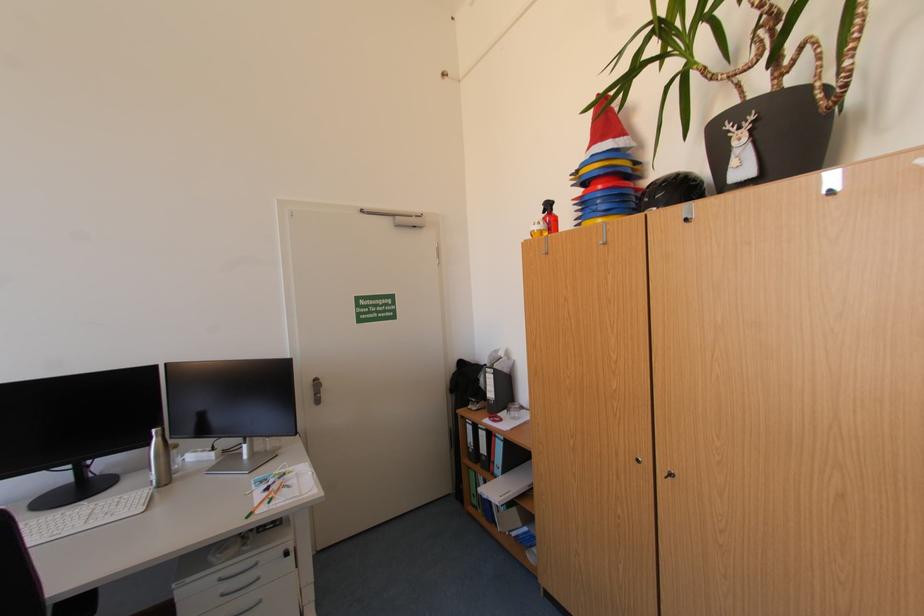
The location [606,169] corresponds to which object?

It corresponds to the stacked colorful cones in the image.